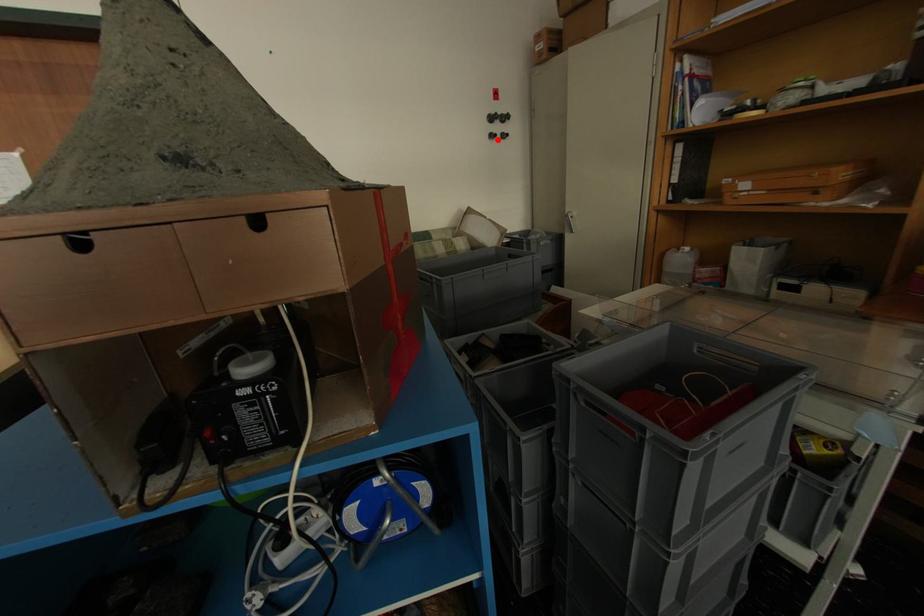
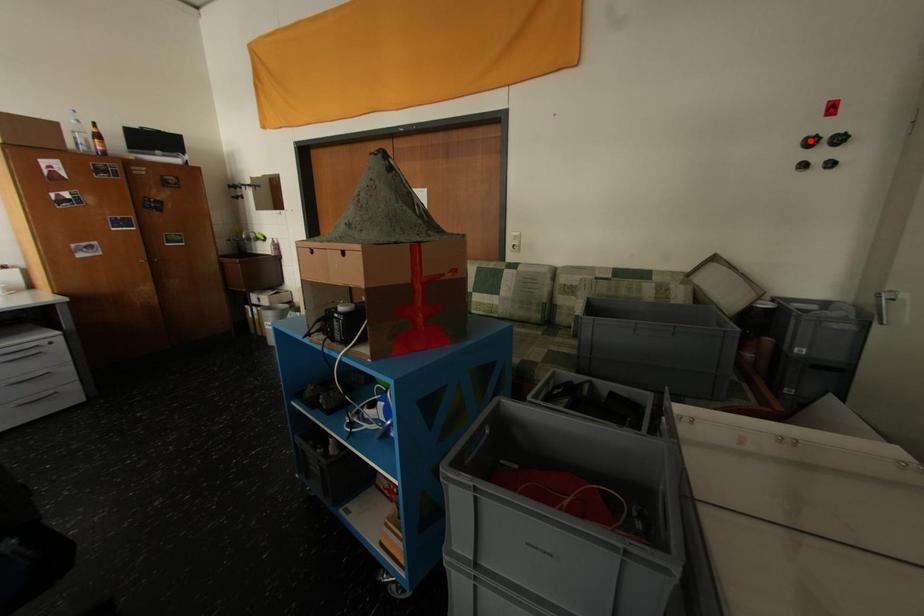
I am providing you with two images of the same scene from different viewpoints. A red point is marked on the first image and another point is marked on the second image. Are the points marked in image1 and image2 representing the same 3D position?

No